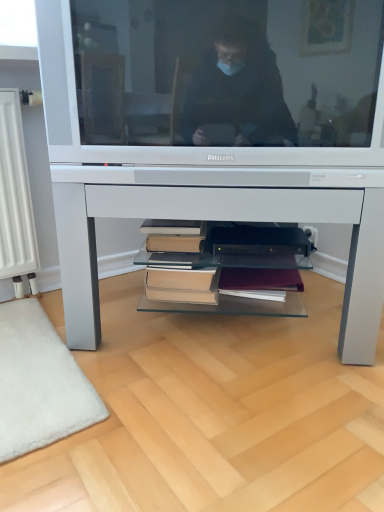
At what (x,y) coordinates should I click in order to perform the action: click on free space in front of white glossy desk at center. Please return your answer as a coordinate pair (x, y). The width and height of the screenshot is (384, 512). Looking at the image, I should click on (209, 416).